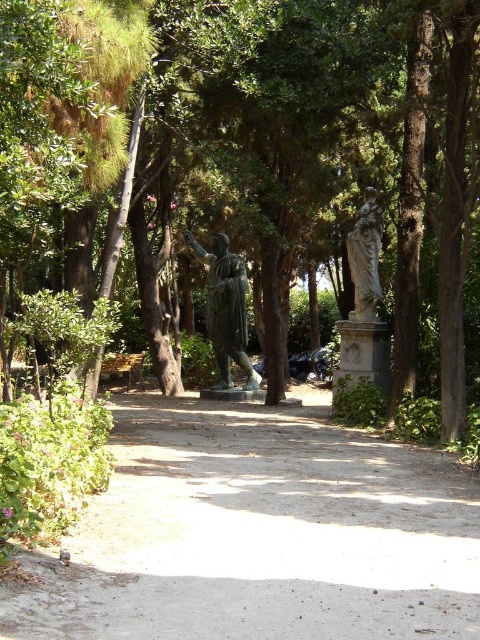
Is dirt path at center above bronze statue at center?

Incorrect, dirt path at center is not positioned above bronze statue at center.

Who is lower down, dirt path at center or bronze statue at center?

dirt path at center is below.

Image resolution: width=480 pixels, height=640 pixels. I want to click on dirt path at center, so click(x=261, y=534).

Identify the location of bronze statue at center. The image size is (480, 640). (226, 308).

Who is positioned more to the right, bronze statue at center or stone statue at center?

stone statue at center is more to the right.

Who is more forward, (232, 253) or (365, 300)?

Point (365, 300) is in front.

You are a GUI agent. You are given a task and a screenshot of the screen. Output one action in this format:
    pyautogui.click(x=<x>, y=<y>)
    Task: Click on the bronze statue at center
    
    Given the screenshot: What is the action you would take?
    pyautogui.click(x=226, y=308)

Can you confirm if green leafy tree at center is shorter than stone statue at center?

In fact, green leafy tree at center may be taller than stone statue at center.

Between green leafy tree at center and stone statue at center, which one appears on the left side from the viewer's perspective?

Positioned to the left is green leafy tree at center.

The image size is (480, 640). I want to click on green leafy tree at center, so click(317, 163).